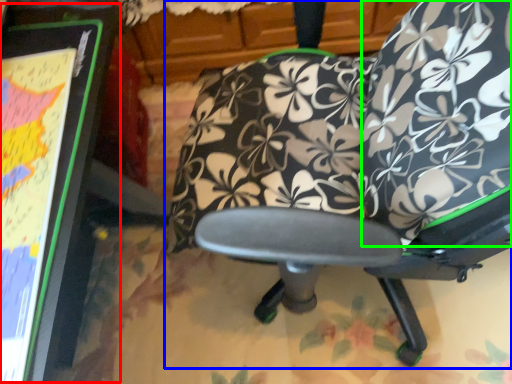
Question: Considering the real-world distances, which object is closest to bulletin board (highlighted by a red box)? chair (highlighted by a blue box) or bean bag chair (highlighted by a green box).

Choices:
 (A) chair
 (B) bean bag chair

Answer: (A)